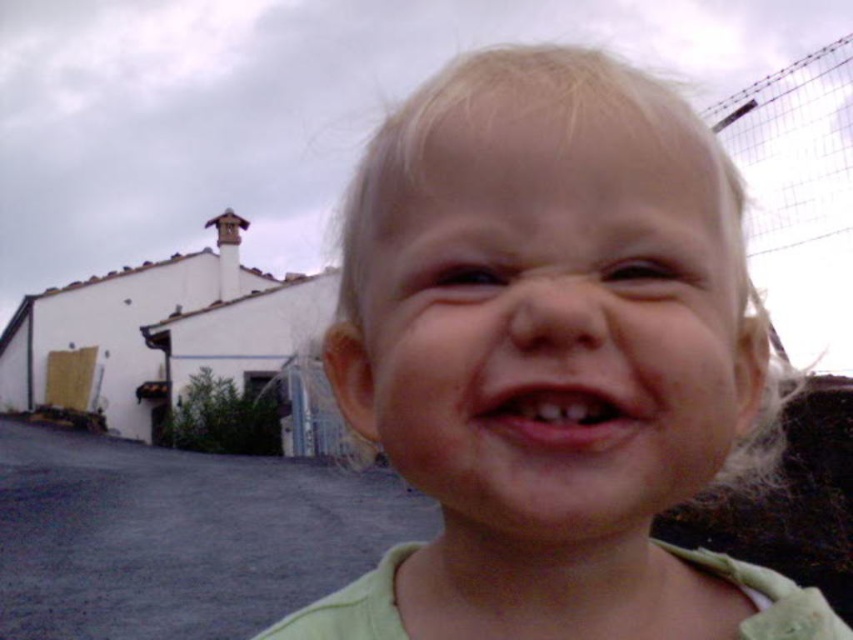
Who is more distant from viewer, (x=647, y=160) or (x=520, y=419)?

Positioned behind is point (x=647, y=160).

Between light blonde hair at center and pink flesh at center, which one is positioned lower?

Result: light blonde hair at center is below.

Which is behind, point (440, 600) or point (595, 433)?

Point (440, 600)

The height and width of the screenshot is (640, 853). I want to click on light blonde hair at center, so click(x=552, y=356).

Who is higher up, light blonde hair at center or pale skin at center?

pale skin at center

How far apart are light blonde hair at center and pale skin at center?

The distance of light blonde hair at center from pale skin at center is 0.98 inches.

Between point (381, 561) and point (714, 352), which one is positioned in front?

Point (714, 352)

The width and height of the screenshot is (853, 640). I want to click on light blonde hair at center, so click(x=552, y=356).

Can you confirm if pale skin at center is wider than pink flesh at center?

Yes.

Can you confirm if pale skin at center is smaller than pink flesh at center?

Incorrect, pale skin at center is not smaller in size than pink flesh at center.

Is point (514, 360) positioned behind point (514, 410)?

No.

This screenshot has height=640, width=853. In order to click on pale skin at center in this screenshot , I will do `click(553, 323)`.